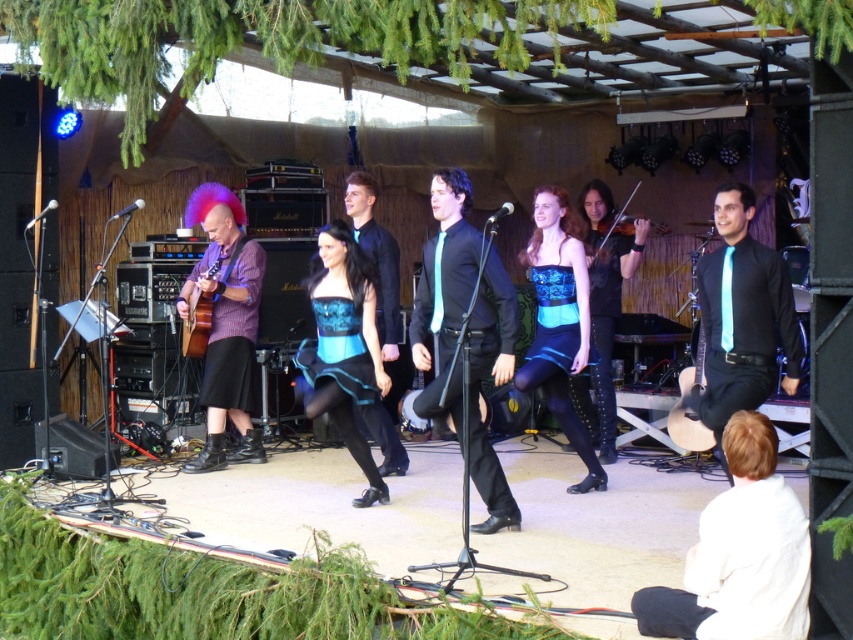
You are a photographer at the event and need to adjust your camera settings to focus on both the light blue satin tie at center and the blue satin dress at center. Which object requires a closer focus due to its smaller size?

The light blue satin tie at center has a smaller size compared to the blue satin dress at center, so the photographer should focus closer on the light blue satin tie at center to capture its details properly.

You are a photographer positioned at the back of the stage. You need to capture a photo where both the black leather dress at center and the shiny black violin at center are visible. Based on their positions, which object should be placed lower in your photo?

The black leather dress at center should be placed lower in the photo because it is positioned below the shiny black violin at center according to the description.